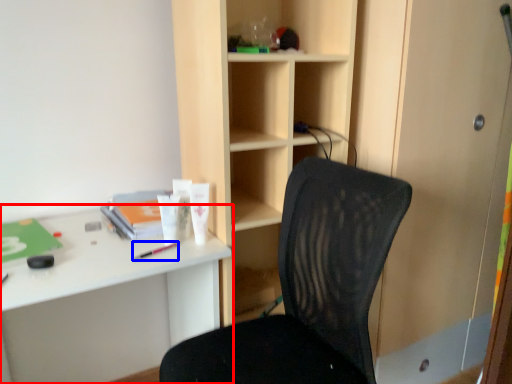
Question: Among these objects, which one is farthest to the camera, desk (highlighted by a red box) or stationery (highlighted by a blue box)?

Choices:
 (A) desk
 (B) stationery

Answer: (B)